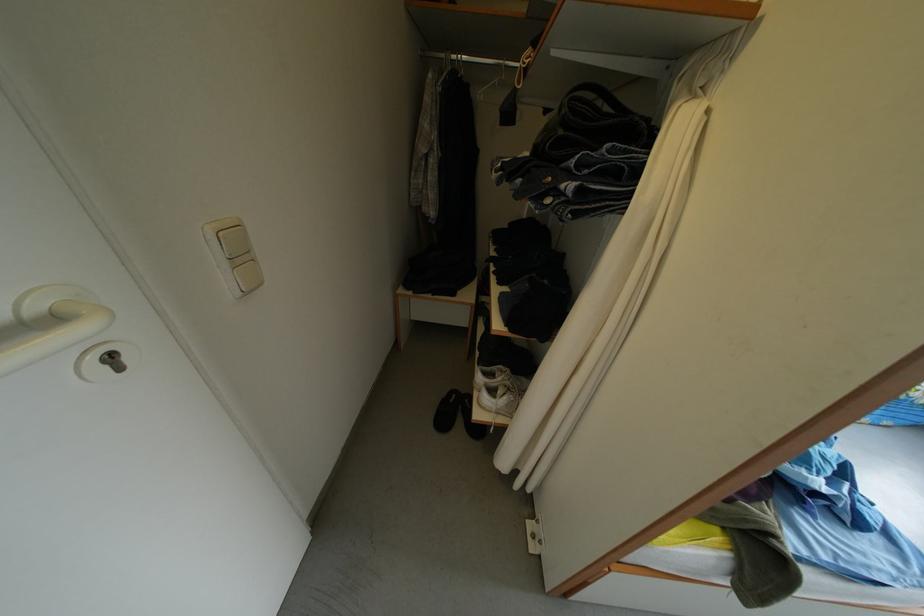
Where is `white curtain`? The image size is (924, 616). white curtain is located at coordinates (596, 249).